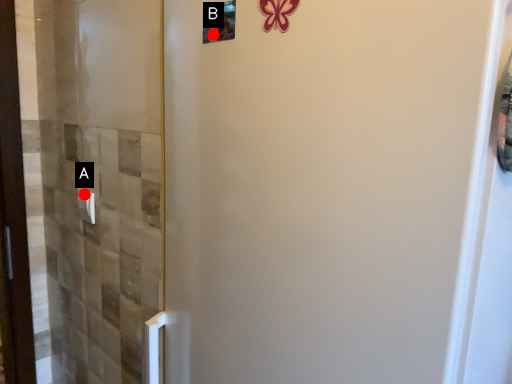
Question: Two points are circled on the image, labeled by A and B beside each circle. Which of the following is the farthest from the observer?

Choices:
 (A) A is further
 (B) B is further

Answer: (A)